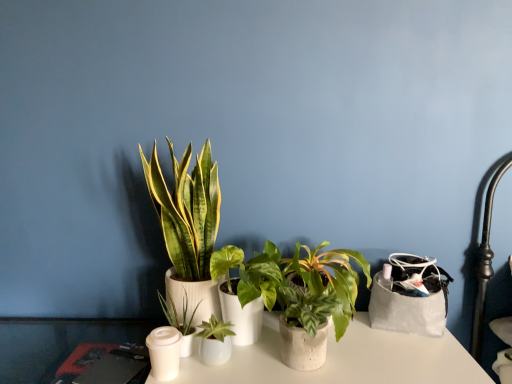
Question: Is the position of green matte plant at center, which ranks as the 4th houseplant in right-to-left order, more distant than that of green leafy plant at center, the first houseplant viewed from the left?

Choices:
 (A) yes
 (B) no

Answer: (A)

Question: Does green matte plant at center, which ranks as the 4th houseplant in right-to-left order, have a larger size compared to green leafy plant at center, the first houseplant viewed from the left?

Choices:
 (A) no
 (B) yes

Answer: (A)

Question: From the image's perspective, is green matte plant at center, the 2th houseplant positioned from the left, beneath green leafy plant at center, the first houseplant viewed from the left?

Choices:
 (A) no
 (B) yes

Answer: (B)

Question: Is there a large distance between green matte plant at center, which ranks as the 4th houseplant in right-to-left order, and green leafy plant at center, the first houseplant viewed from the left?

Choices:
 (A) no
 (B) yes

Answer: (A)

Question: Is green leafy plant at center, the first houseplant viewed from the left, at the back of green matte plant at center, which ranks as the 4th houseplant in right-to-left order?

Choices:
 (A) no
 (B) yes

Answer: (B)

Question: Considering the relative sizes of green matte plant at center, the 2th houseplant positioned from the left, and green leafy plant at center, the fifth houseplant viewed from the right, in the image provided, is green matte plant at center, the 2th houseplant positioned from the left, thinner than green leafy plant at center, the fifth houseplant viewed from the right,?

Choices:
 (A) yes
 (B) no

Answer: (A)

Question: Is the depth of white matte candle holder at lower left greater than that of green matte plant at center, acting as the second houseplant starting from the right?

Choices:
 (A) no
 (B) yes

Answer: (B)

Question: From a real-world perspective, is white matte candle holder at lower left located higher than green matte plant at center, the 4th houseplant from the left?

Choices:
 (A) no
 (B) yes

Answer: (A)

Question: Can you confirm if white matte candle holder at lower left is thinner than green matte plant at center, acting as the second houseplant starting from the right?

Choices:
 (A) yes
 (B) no

Answer: (A)

Question: Does white matte candle holder at lower left have a greater width compared to green matte plant at center, the 4th houseplant from the left?

Choices:
 (A) no
 (B) yes

Answer: (A)

Question: Is white matte candle holder at lower left to the left of green matte plant at center, the 4th houseplant from the left, from the viewer's perspective?

Choices:
 (A) no
 (B) yes

Answer: (B)

Question: Is white matte candle holder at lower left positioned beyond the bounds of green matte plant at center, the 4th houseplant from the left?

Choices:
 (A) no
 (B) yes

Answer: (B)

Question: Is green matte plant at center, the 2th houseplant positioned from the left, at the left side of green matte plant at center, acting as the second houseplant starting from the right?

Choices:
 (A) yes
 (B) no

Answer: (A)